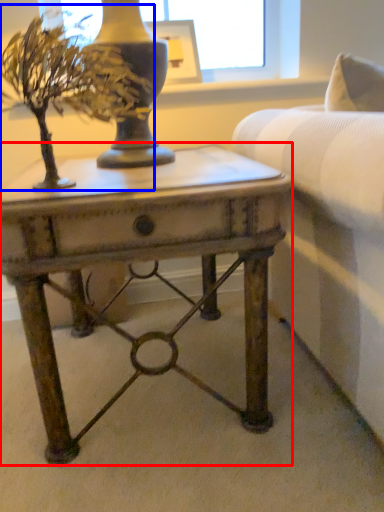
Question: Which point is closer to the camera, table (highlighted by a red box) or houseplant (highlighted by a blue box)?

Choices:
 (A) table
 (B) houseplant

Answer: (B)